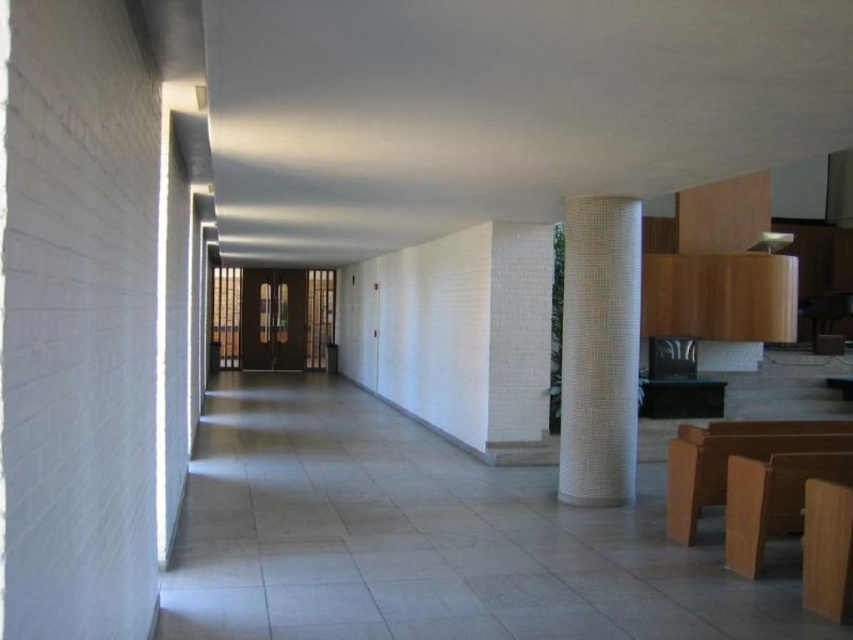
You are standing in the room and see the point at coordinates [599,349]. Which object is this point located on?

The point at coordinates [599,349] is located on the white textured pillar at center.

You are standing in the room and want to place a new decorative item exactly at the center of the room. Given the white textured pillar at center is located at point 0.548, 0.703, where should you place the decorative item to ensure it is at the true center of the room?

The true center of the room would be at coordinates (426, 320). Since the white textured pillar at center is at (599, 349), you should move slightly to the left and upwards from the pillar to reach the true center at (426, 320).

You are a stagehand setting up equipment in the room. You need to place a tall speaker that is 2 meters in height. Can the speaker be placed between the white textured pillar at center and the light brown wood church bench at lower right without hitting the ceiling?

The white textured pillar at center has a greater height compared to light brown wood church bench at lower right. Since the pillar is taller, it is possible that the ceiling height in that area is sufficient to accommodate the 2 meter tall speaker. However, without specific ceiling height information, it is uncertain. The speaker should be placed in an area where both objects are present and ensure it doesn not exceed the ceiling height.